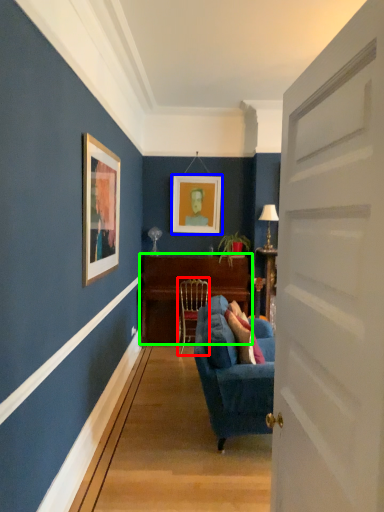
Question: Which object is the farthest from chair (highlighted by a red box)? Choose among these: picture frame (highlighted by a blue box) or table (highlighted by a green box).

Choices:
 (A) picture frame
 (B) table

Answer: (A)